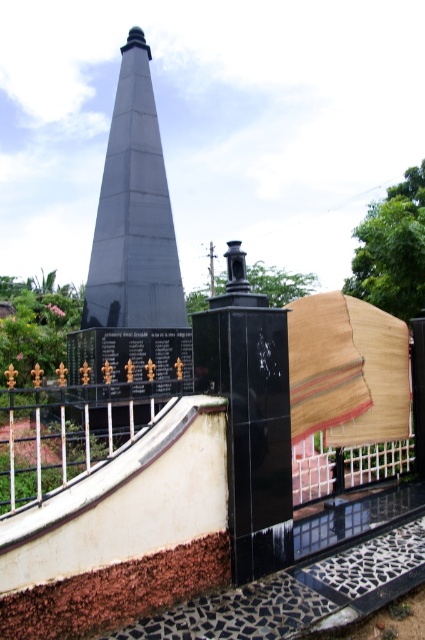
Based on the photo, you are standing in front of the memorial structure. You want to take a photo of the smooth gray obelisk at center with your phone. Your phone can focus clearly on objects up to 5 meters away. Will the obelisk be in focus?

The smooth gray obelisk at center is 5.49 meters away from the camera. Since your phone can focus up to 5 meters, the obelisk is slightly beyond the focus range, so it may appear blurry in the photo.

You are an architect designing a new memorial. You need to ensure that the smooth gray obelisk at center and the gold wrought iron railing at lower left will fit within a 10 meter wide space. Given their relative sizes, can you confirm if both can fit side by side without overlapping?

The smooth gray obelisk at center is wider than the gold wrought iron railing at lower left. However, without knowing their exact widths, it is impossible to determine if both can fit within the 10 meter space. More specific measurements are needed.

From the picture: You are standing in front of the memorial structure. You see the smooth gray obelisk at center and the gold wrought iron railing at lower left. Which object is closer to you?

The smooth gray obelisk at center is closer to you since the gold wrought iron railing at lower left is behind it.